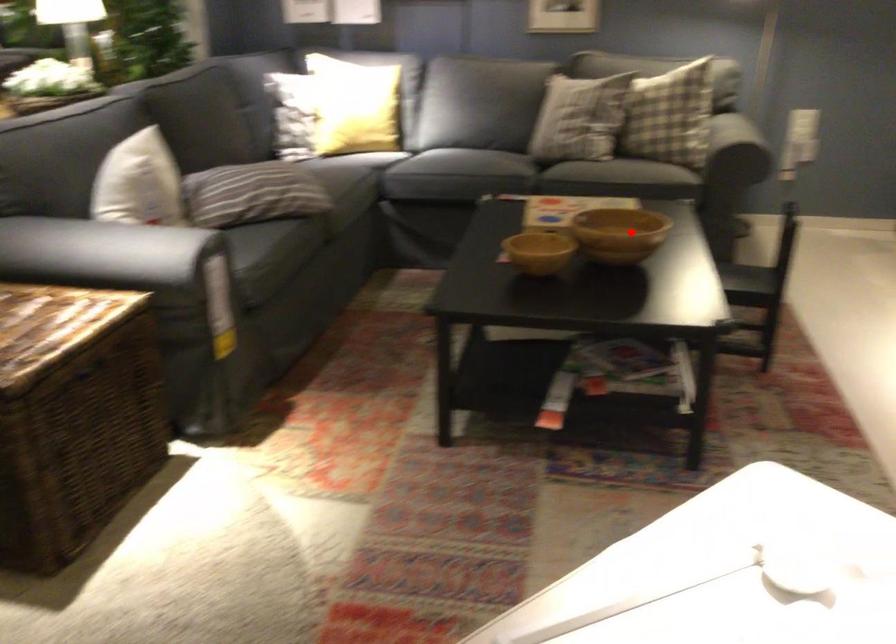
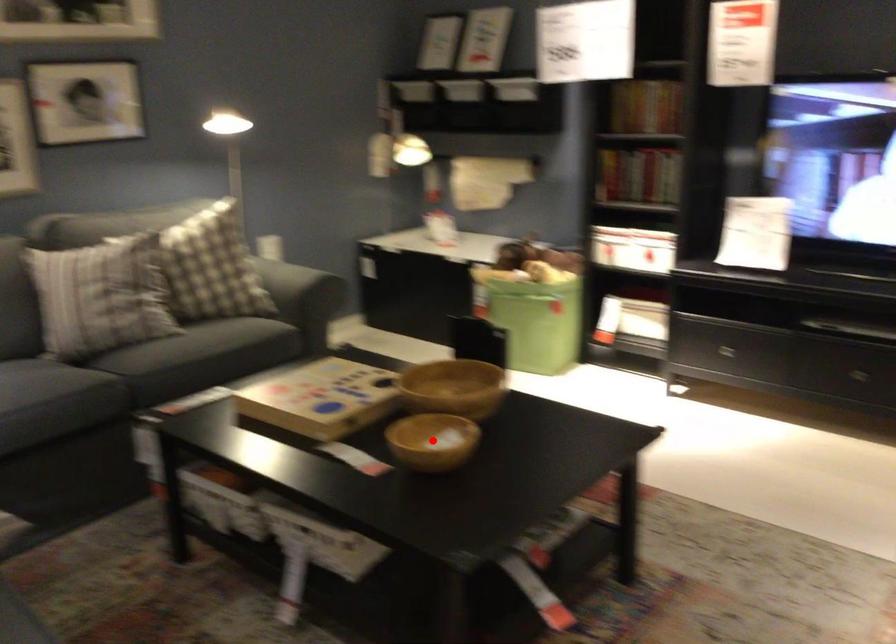
I am providing you with two images of the same scene from different viewpoints. A red point is marked on the first image and another point is marked on the second image. Are the points marked in image1 and image2 representing the same 3D position?

No